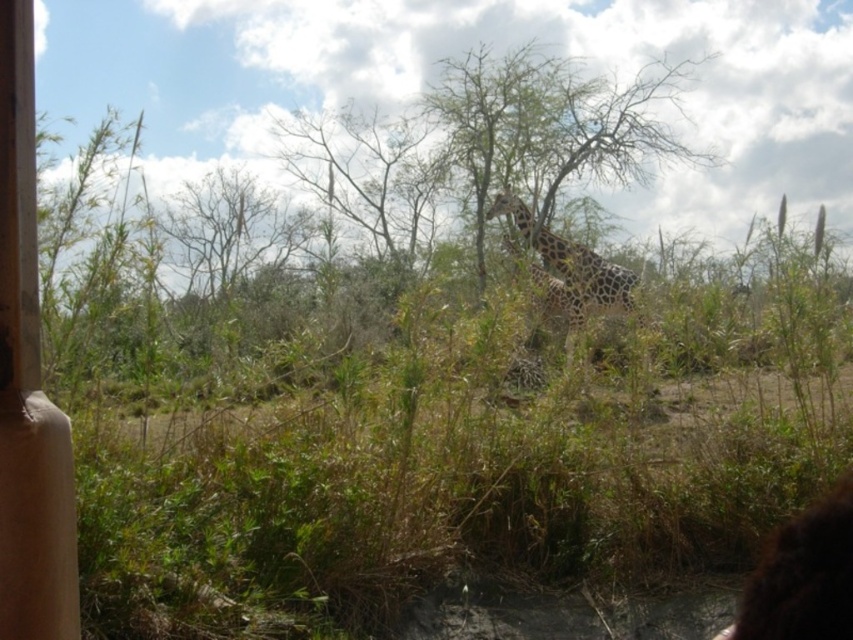
Question: Is green grass at center positioned behind bare wood tree at center?

Choices:
 (A) yes
 (B) no

Answer: (B)

Question: Can you confirm if green grass at center is positioned to the left of spotted-patterned giraffe at center?

Choices:
 (A) yes
 (B) no

Answer: (A)

Question: Which point is farther from the camera taking this photo?

Choices:
 (A) (544, 252)
 (B) (619, 456)

Answer: (A)

Question: Can you confirm if green grass at center is smaller than bare wood tree at center?

Choices:
 (A) yes
 (B) no

Answer: (B)

Question: Which object is closer to the camera taking this photo?

Choices:
 (A) spotted-patterned giraffe at center
 (B) bare wood tree at center

Answer: (A)

Question: Which of these objects is positioned closest to the bare wood tree at center?

Choices:
 (A) spotted-patterned giraffe at center
 (B) green grass at center

Answer: (A)